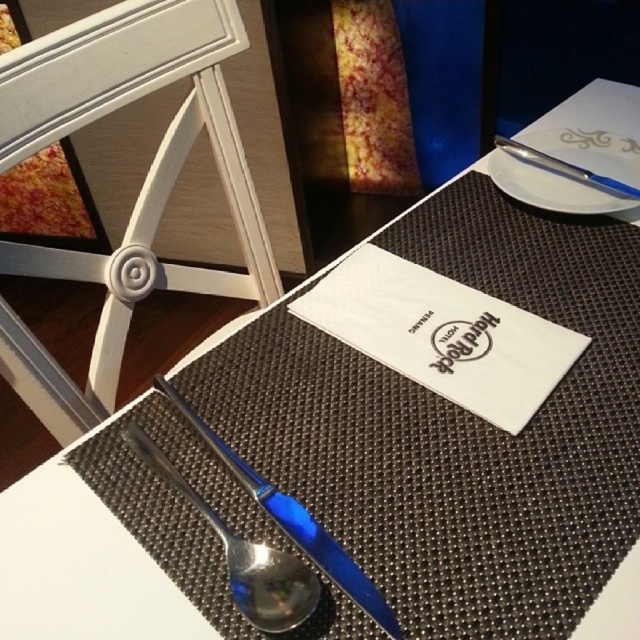
Which is more to the left, white wood chair at upper left or shiny metal pen at upper right?

white wood chair at upper left is more to the left.

Is point (205, 29) positioned in front of point (596, 179)?

No, it is not.

You are a GUI agent. You are given a task and a screenshot of the screen. Output one action in this format:
    pyautogui.click(x=<x>, y=<y>)
    Task: Click on the white wood chair at upper left
    The height and width of the screenshot is (640, 640).
    Given the screenshot: What is the action you would take?
    pyautogui.click(x=140, y=189)

Based on the photo, can you confirm if blue plastic spoon at center is bigger than shiny metal pen at upper right?

Yes, blue plastic spoon at center is bigger than shiny metal pen at upper right.

Does blue plastic spoon at center have a lesser height compared to shiny metal pen at upper right?

Incorrect, blue plastic spoon at center's height does not fall short of shiny metal pen at upper right's.

Which is in front, point (131, 428) or point (544, 157)?

Point (131, 428)

Image resolution: width=640 pixels, height=640 pixels. Identify the location of blue plastic spoon at center. (243, 556).

Does blue polished spoon at center lie behind shiny metal pen at upper right?

No.

Is blue polished spoon at center below shiny metal pen at upper right?

Yes, blue polished spoon at center is below shiny metal pen at upper right.

Is point (356, 586) more distant than point (589, 170)?

No, it is in front of (589, 170).

Where is `blue polished spoon at center`? The width and height of the screenshot is (640, 640). blue polished spoon at center is located at coordinates (292, 520).